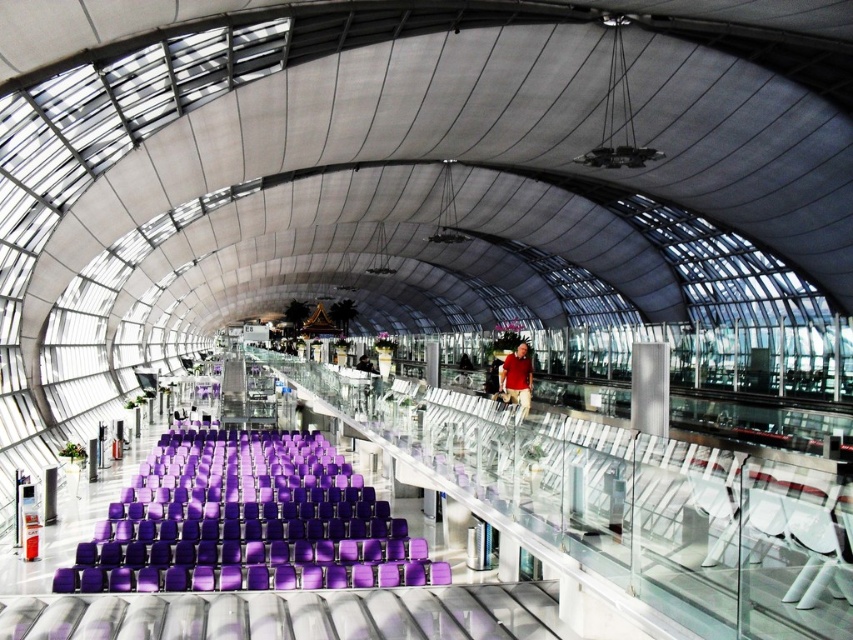
Based on the photo, you are a traveler looking for your luggage at the terminal. You see a red matte shirt at center and a matte black shirt at center. Which shirt is closer to the ceiling?

The red matte shirt at center is located above the matte black shirt at center, so it is closer to the ceiling.

You are standing at the entrance of the terminal and want to find the purple fabric chair at center. According to the coordinates given, in which direction should you walk from the entrance to reach it?

The purple fabric chair at center is located at coordinates point (x=244, y=518). Since the entrance is typically at the front of the terminal, which would be the lower part of the image, moving towards the center coordinates would mean walking towards the upper right direction from the entrance.

You are a traveler who just arrived at the terminal and noticed two shirts hanging on a rack at the center. The red matte shirt at center and the matte black shirt at center. Which shirt is taller?

The red matte shirt at center is taller than the matte black shirt at center.